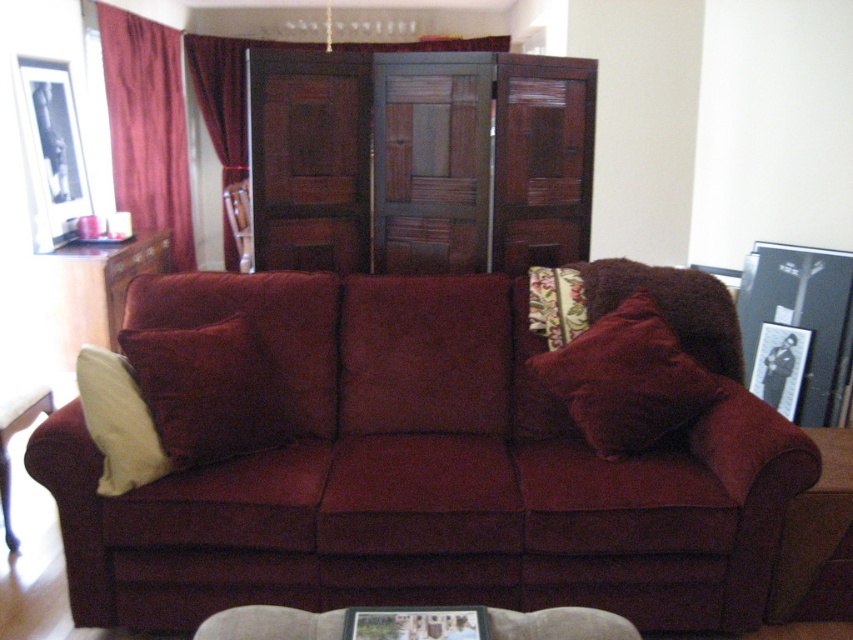
Can you confirm if black matte picture frame at upper left is positioned to the left of velvet burgundy curtain at left?

Yes, black matte picture frame at upper left is to the left of velvet burgundy curtain at left.

Between black matte picture frame at upper left and velvet burgundy curtain at left, which one appears on the right side from the viewer's perspective?

velvet burgundy curtain at left

The height and width of the screenshot is (640, 853). I want to click on black matte picture frame at upper left, so click(x=51, y=150).

Which is above, velvet yellow pillow at left or burgundy velvet curtain at left?

burgundy velvet curtain at left is higher up.

Is velvet yellow pillow at left positioned in front of burgundy velvet curtain at left?

That is True.

This screenshot has height=640, width=853. What do you see at coordinates (207, 388) in the screenshot?
I see `velvet yellow pillow at left` at bounding box center [207, 388].

Find the location of a particular element. velvet yellow pillow at left is located at coordinates (207, 388).

I want to click on velvet yellow pillow at left, so click(207, 388).

Does velvet yellow pillow at left have a greater height compared to matte fabric couch at lower left?

No, velvet yellow pillow at left is not taller than matte fabric couch at lower left.

Does point (141, 340) come behind point (42, 412)?

No, it is in front of (42, 412).

The width and height of the screenshot is (853, 640). What are the coordinates of `velvet yellow pillow at left` in the screenshot? It's located at (207, 388).